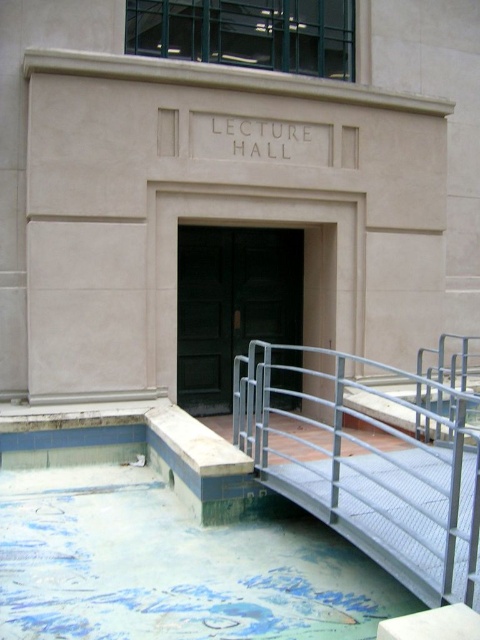
In the scene shown: Does metal mesh ramp at lower center lie in front of green matte door at center?

Yes, it is in front of green matte door at center.

Is metal mesh ramp at lower center below green matte door at center?

Correct, metal mesh ramp at lower center is located below green matte door at center.

Who is more distant from viewer, [476,465] or [194,371]?

Positioned behind is point [194,371].

Identify the location of metal mesh ramp at lower center. The width and height of the screenshot is (480, 640). (376, 468).